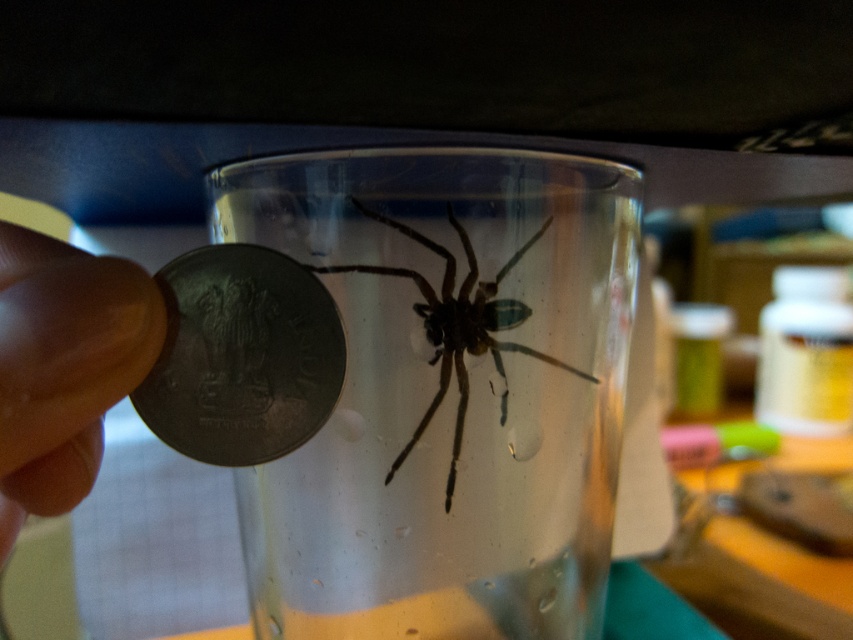
Question: From the image, what is the correct spatial relationship of transparent glass at center in relation to matte metallic coin at left?

Choices:
 (A) right
 (B) left

Answer: (A)

Question: Can you confirm if transparent glass at center is positioned to the right of metallic gray coin at lower left?

Choices:
 (A) no
 (B) yes

Answer: (B)

Question: Is transparent glass at center bigger than metallic gray coin at lower left?

Choices:
 (A) yes
 (B) no

Answer: (A)

Question: Which object is closer to the camera taking this photo?

Choices:
 (A) translucent glass spider at center
 (B) transparent glass at center
 (C) metallic gray coin at lower left
 (D) matte metallic coin at left

Answer: (C)

Question: Which object is positioned closest to the matte metallic coin at left?

Choices:
 (A) transparent glass at center
 (B) metallic gray coin at lower left
 (C) translucent glass spider at center

Answer: (B)

Question: Based on their relative distances, which object is nearer to the matte metallic coin at left?

Choices:
 (A) transparent glass at center
 (B) translucent glass spider at center
 (C) metallic gray coin at lower left

Answer: (C)